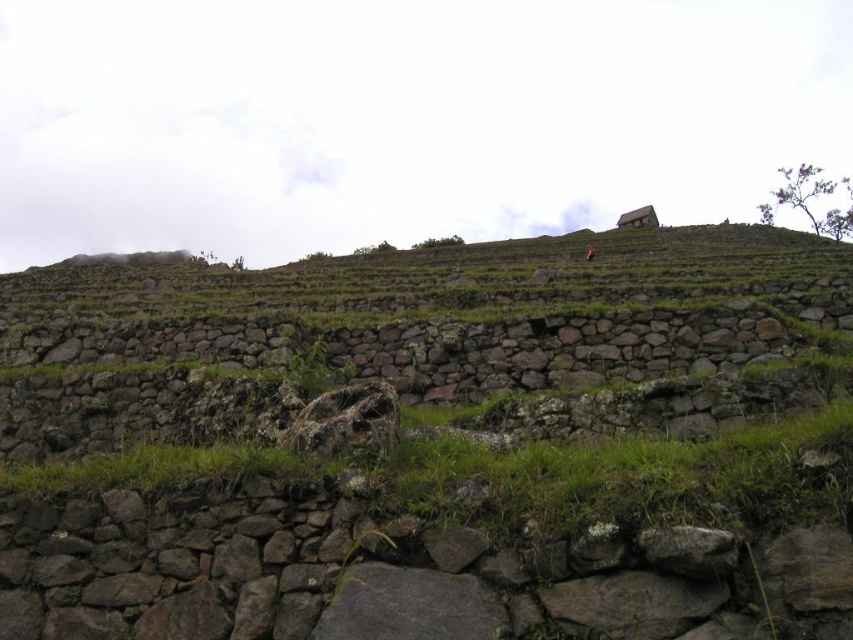
Question: Does brown wooden hut at upper center appear over brown stone figure at upper center?

Choices:
 (A) yes
 (B) no

Answer: (A)

Question: Does natural stone terraces at upper center have a lesser width compared to brown wooden hut at upper center?

Choices:
 (A) yes
 (B) no

Answer: (B)

Question: Does brown wooden hut at upper center appear on the right side of brown stone figure at upper center?

Choices:
 (A) no
 (B) yes

Answer: (B)

Question: Which object is farther from the camera taking this photo?

Choices:
 (A) natural stone terraces at upper center
 (B) brown stone figure at upper center
 (C) brown wooden hut at upper center

Answer: (C)

Question: Among these points, which one is farthest from the camera?

Choices:
 (A) (646, 218)
 (B) (585, 253)

Answer: (A)

Question: Considering the real-world distances, which object is farthest from the brown stone figure at upper center?

Choices:
 (A) natural stone terraces at upper center
 (B) brown wooden hut at upper center

Answer: (B)